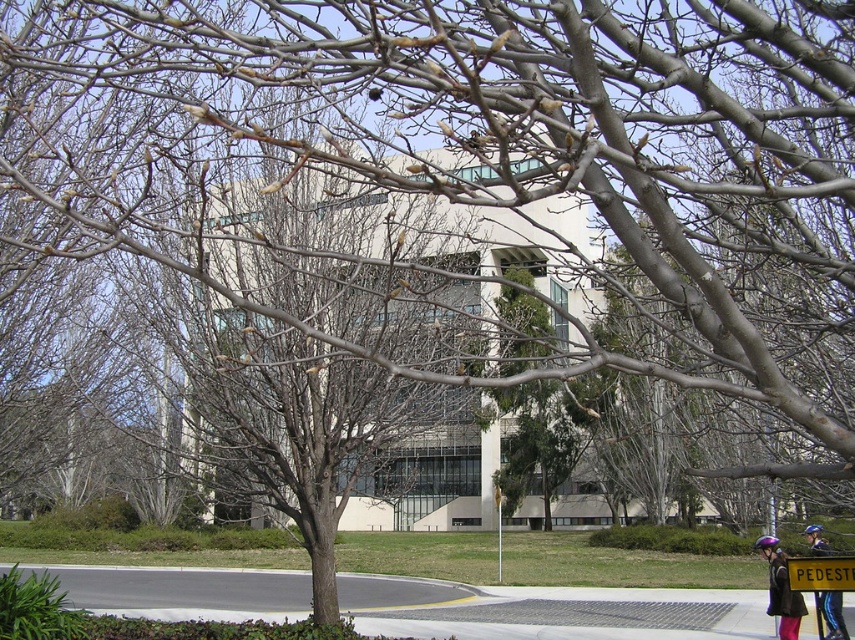
Question: Does purple helmet at lower right have a larger size compared to yellow plastic sign at center?

Choices:
 (A) no
 (B) yes

Answer: (B)

Question: Can you confirm if yellow plastic sign at center is positioned to the right of blue helmet at lower right?

Choices:
 (A) no
 (B) yes

Answer: (A)

Question: Can you confirm if purple helmet at lower right is positioned to the right of blue helmet at lower right?

Choices:
 (A) yes
 (B) no

Answer: (B)

Question: Which object is farther from the camera taking this photo?

Choices:
 (A) yellow plastic sign at center
 (B) blue helmet at lower right

Answer: (B)

Question: Which point is closer to the camera?

Choices:
 (A) (818, 540)
 (B) (782, 634)
 (C) (799, 576)

Answer: (C)

Question: Considering the real-world distances, which object is farthest from the purple helmet at lower right?

Choices:
 (A) yellow plastic sign at center
 (B) blue helmet at lower right

Answer: (A)